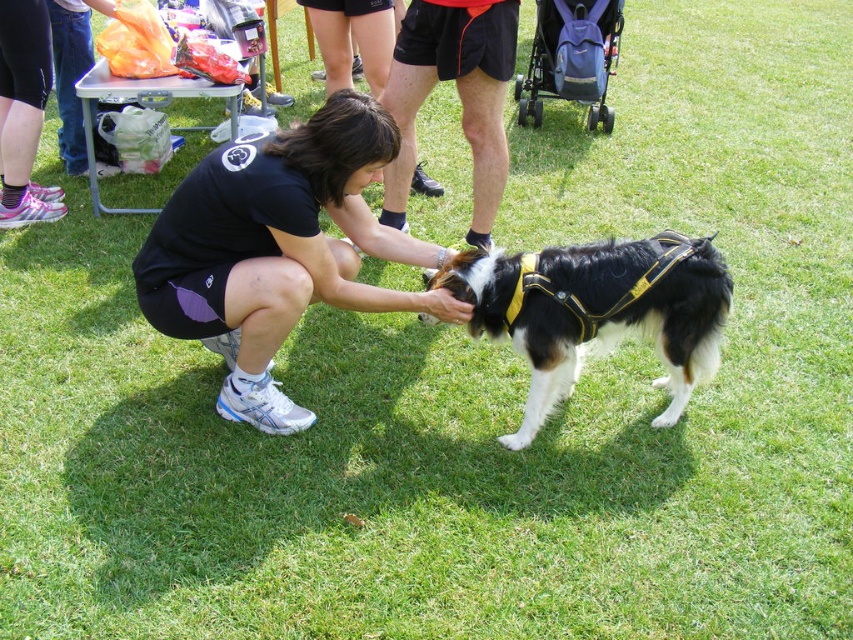
Which is below, black fabric squat at center or black athletic shorts at center?

black fabric squat at center

Does black fabric squat at center lie behind black athletic shorts at center?

No, black fabric squat at center is closer to the viewer.

What do you see at coordinates (276, 250) in the screenshot? The height and width of the screenshot is (640, 853). I see `black fabric squat at center` at bounding box center [276, 250].

This screenshot has height=640, width=853. Identify the location of black fabric squat at center. (276, 250).

Can you confirm if black and white fur at center is smaller than black athletic shorts at center?

No, black and white fur at center is not smaller than black athletic shorts at center.

Does black and white fur at center have a larger size compared to black athletic shorts at center?

Yes.

Is point (643, 328) positioned behind point (469, 83)?

No, it is not.

You are a GUI agent. You are given a task and a screenshot of the screen. Output one action in this format:
    pyautogui.click(x=<x>, y=<y>)
    Task: Click on the black and white fur at center
    
    Given the screenshot: What is the action you would take?
    pyautogui.click(x=596, y=310)

Is black fabric squat at center to the left of black and white fur at center from the viewer's perspective?

Yes, black fabric squat at center is to the left of black and white fur at center.

Is black fabric squat at center closer to camera compared to black and white fur at center?

Yes, black fabric squat at center is closer to the viewer.

At what (x,y) coordinates should I click in order to perform the action: click on black fabric squat at center. Please return your answer as a coordinate pair (x, y). The height and width of the screenshot is (640, 853). Looking at the image, I should click on (276, 250).